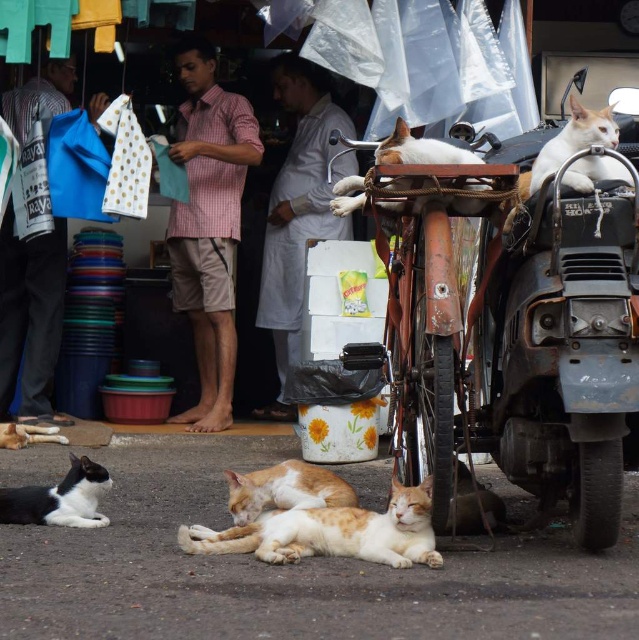
Where is `orange tabby cat at center`? This screenshot has height=640, width=639. orange tabby cat at center is located at coordinates (332, 532).

Who is more forward, [256,531] or [27,520]?

Point [256,531]

What do you see at coordinates (332, 532) in the screenshot?
I see `orange tabby cat at center` at bounding box center [332, 532].

Identify the location of orange tabby cat at center. Image resolution: width=639 pixels, height=640 pixels. (332, 532).

Is rusty metal motorcycle at upper right below white fur cat at center?

Yes.

Is rusty metal motorcycle at upper right thinner than white fur cat at center?

In fact, rusty metal motorcycle at upper right might be wider than white fur cat at center.

Between point (491, 284) and point (481, 161), which one is positioned in front?

Point (491, 284) is in front.

At what (x,y) coordinates should I click in order to perform the action: click on rusty metal motorcycle at upper right. Please return your answer as a coordinate pair (x, y). Looking at the image, I should click on (520, 323).

Is white fur cat at center behind white fur cat at lower left?

No, white fur cat at center is in front of white fur cat at lower left.

Is point (403, 134) in front of point (19, 438)?

Yes, it is in front of point (19, 438).

Where is `white fur cat at center`? white fur cat at center is located at coordinates (420, 148).